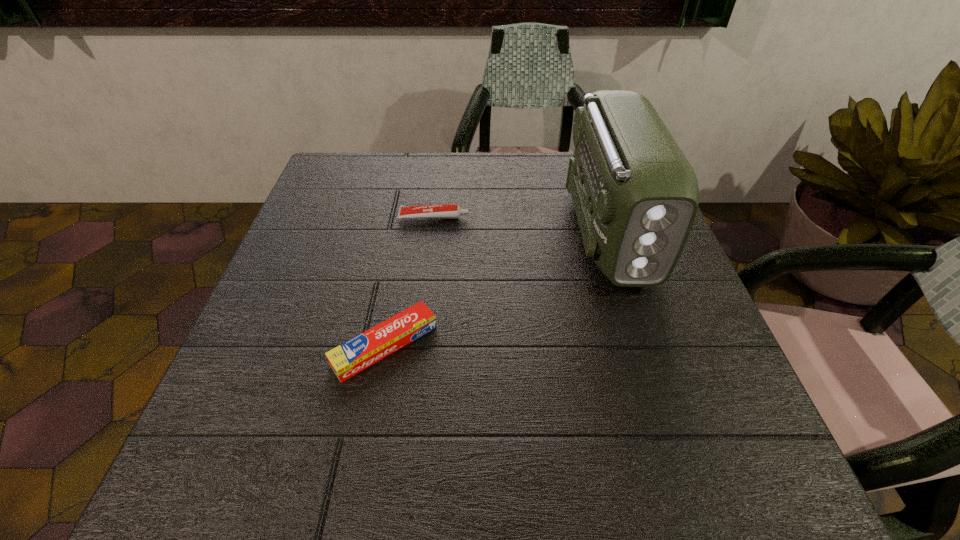
The width and height of the screenshot is (960, 540). What are the coordinates of `object positioned at the far right corner` in the screenshot? It's located at (635, 194).

The image size is (960, 540). I want to click on free space at the far edge, so click(500, 159).

The image size is (960, 540). In the image, there is a desktop. Find the location of `vacant space at the near edge`. vacant space at the near edge is located at coordinates pyautogui.click(x=321, y=453).

This screenshot has height=540, width=960. What are the coordinates of `free space at the left edge of the desktop` in the screenshot? It's located at (285, 327).

Where is `free space at the right edge of the desktop`? Image resolution: width=960 pixels, height=540 pixels. free space at the right edge of the desktop is located at coordinates (620, 304).

Locate an element on the screen. This screenshot has height=540, width=960. free region at the far left corner is located at coordinates (333, 176).

Where is `free space between the nearer toothpaste and the rightmost object`? free space between the nearer toothpaste and the rightmost object is located at coordinates (497, 287).

This screenshot has height=540, width=960. I want to click on empty location between the nearest object and the farther toothpaste, so pyautogui.click(x=410, y=281).

This screenshot has width=960, height=540. Identify the location of free spot between the farther toothpaste and the rightmost object. (521, 224).

The image size is (960, 540). Find the location of `free space between the rightmost object and the farther toothpaste`. free space between the rightmost object and the farther toothpaste is located at coordinates (521, 224).